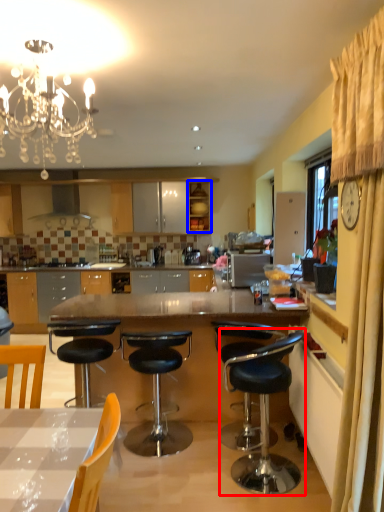
Question: Among these objects, which one is nearest to the camera, chair (highlighted by a red box) or cabinetry (highlighted by a blue box)?

Choices:
 (A) chair
 (B) cabinetry

Answer: (A)